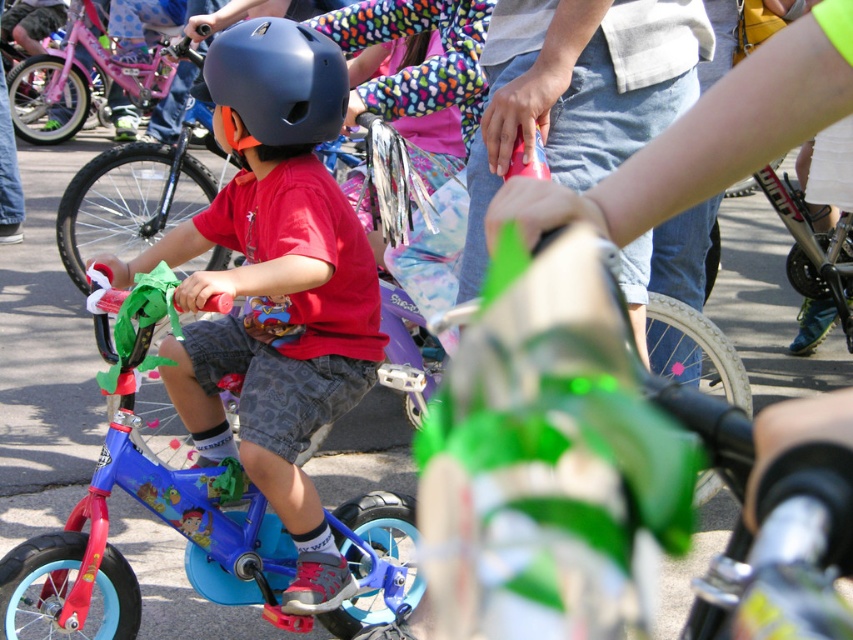
You are a safety inspector checking helmets at a childrens bicycle event. You need to ensure all helmets meet the minimum height requirement of 10 cm. The matte blue helmet at center and the matte black helmet at center are both being inspected. Which helmet meets the requirement?

The matte blue helmet at center has a greater height compared to matte black helmet at center. Since the blue helmet is taller, it meets the 10 cm height requirement, while the black helmet may not.

You are a photographer setting up for a bicycle event. You need to position a camera to capture both the matte blue helmet at center and the pink matte bicycle at left in the same frame. Considering their heights, which object should be placed lower in the frame to ensure both are fully visible?

The pink matte bicycle at left should be placed lower in the frame because the matte blue helmet at center is taller. This way, both objects can be fully captured without any part being cut off.

You are organizing a helmet fitting session for kids and have two helmets available. The matte blue helmet at center and the matte black helmet at center. A child has a head circumference of 50 cm. Which helmet is more likely to fit the child?

The matte blue helmet at center has a larger size compared to the matte black helmet at center. Therefore, the matte blue helmet at center is more likely to fit a child with a head circumference of 50 cm.